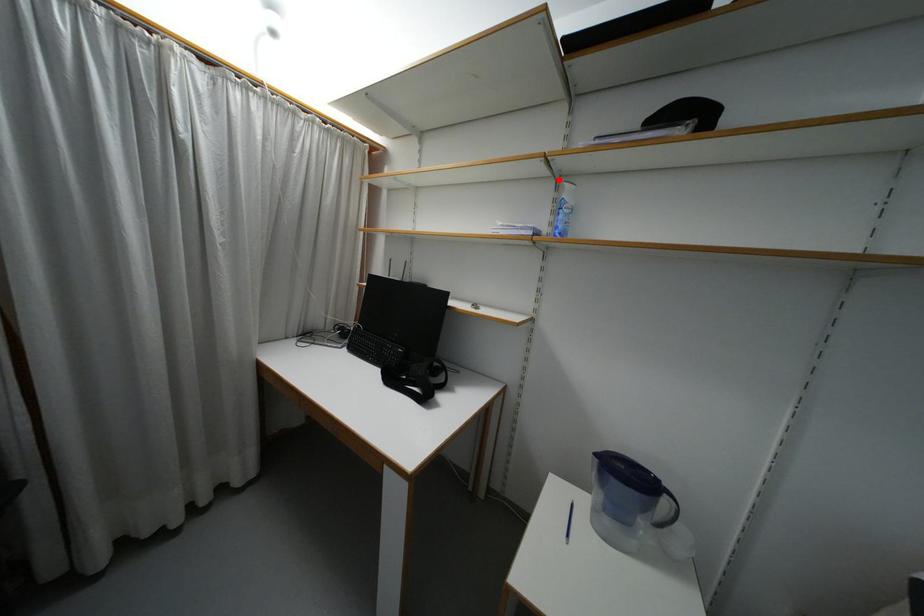
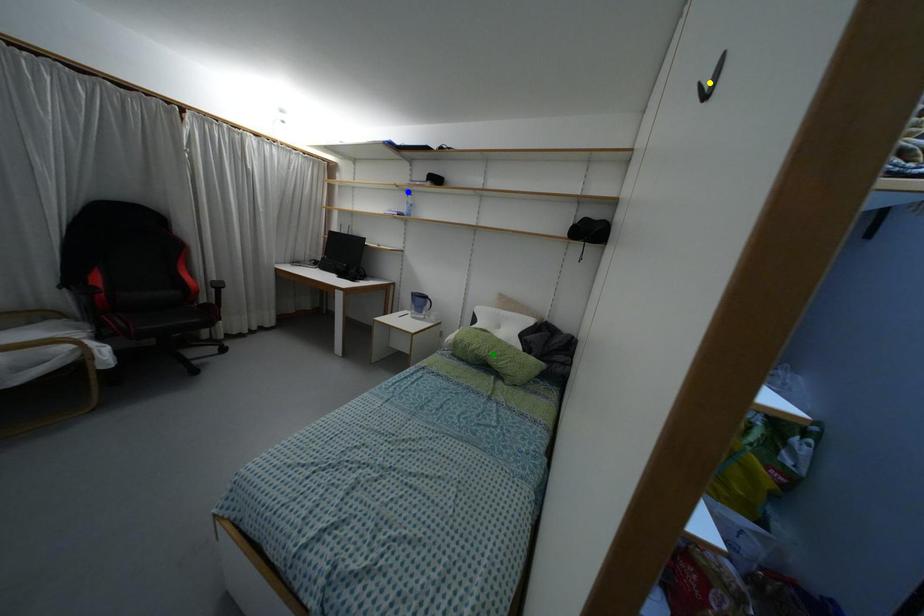
Question: I am providing you with two images of the same scene from different viewpoints. A red point is marked on the first image. You are given multiple points on the second image. Which point in image 2 is actually the same real-world point as the red point in image 1?

Choices:
 (A) green point
 (B) yellow point
 (C) blue point

Answer: (C)